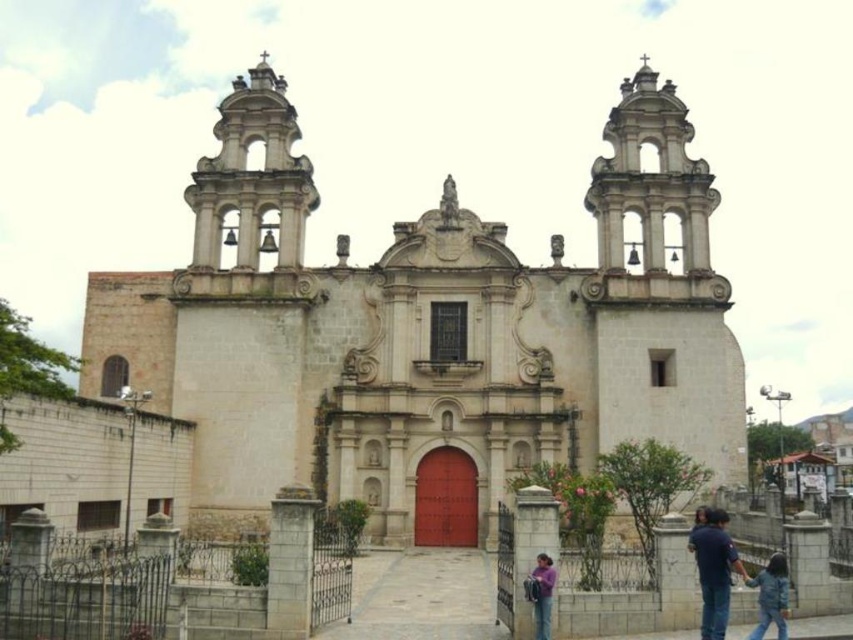
Question: Which of the following is the closest to the observer?

Choices:
 (A) denim jacket at lower right
 (B) blue jeans at lower right

Answer: (B)

Question: Does denim jacket at lower right appear over purple cotton shirt at lower center?

Choices:
 (A) no
 (B) yes

Answer: (A)

Question: Is denim jacket at lower right to the right of purple cotton shirt at lower center from the viewer's perspective?

Choices:
 (A) yes
 (B) no

Answer: (A)

Question: Does blue jeans at lower right have a lesser width compared to denim jacket at lower right?

Choices:
 (A) yes
 (B) no

Answer: (A)

Question: Which point is farther to the camera?

Choices:
 (A) blue jeans at lower right
 (B) purple cotton shirt at lower center
 (C) denim jacket at lower right

Answer: (C)

Question: Which point is farther to the camera?

Choices:
 (A) (550, 560)
 (B) (767, 572)
 (C) (726, 548)

Answer: (B)